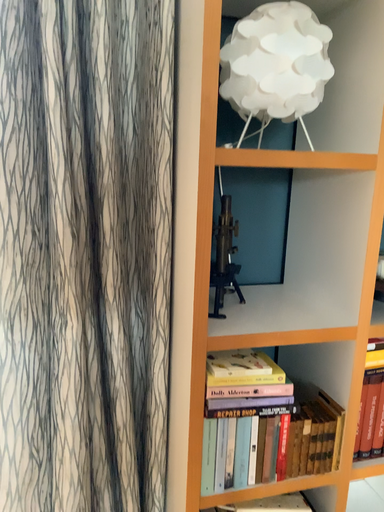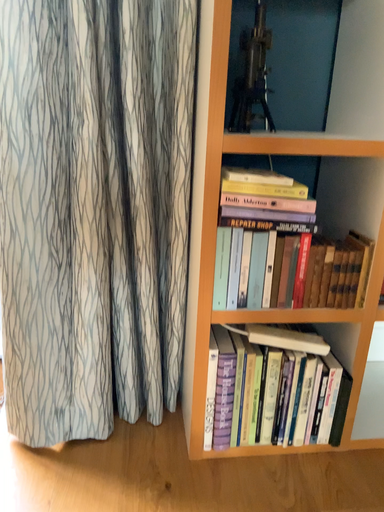
Question: Which way did the camera rotate in the video?

Choices:
 (A) rotated right
 (B) rotated left

Answer: (B)